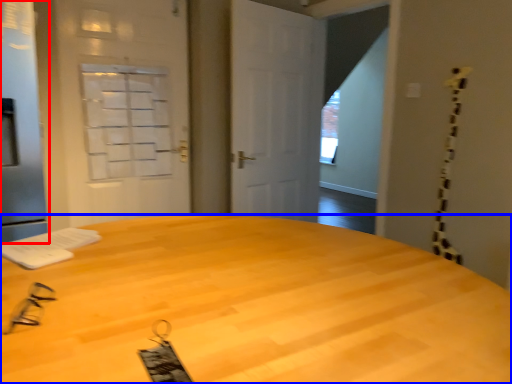
Question: Which object appears closest to the camera in this image, screen door (highlighted by a red box) or desk (highlighted by a blue box)?

Choices:
 (A) screen door
 (B) desk

Answer: (B)